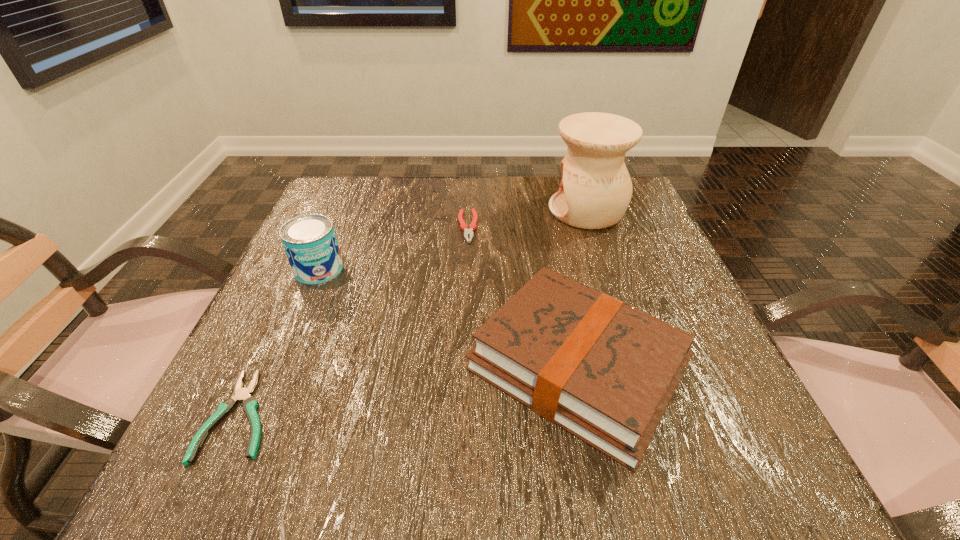
In order to click on free region located 0.120m at the open side of the tallest object in this screenshot , I will do `click(498, 210)`.

You are a GUI agent. You are given a task and a screenshot of the screen. Output one action in this format:
    pyautogui.click(x=<x>, y=<y>)
    Task: Click on the blank space located 0.270m on the front of the fourth shortest object
    The height and width of the screenshot is (540, 960).
    Given the screenshot: What is the action you would take?
    pyautogui.click(x=260, y=407)

The image size is (960, 540). In order to click on vacant region located on the back of the hardback book in this screenshot , I will do `click(548, 222)`.

Where is `vacant space located on the front of the taller pliers`? vacant space located on the front of the taller pliers is located at coordinates (465, 321).

You are a GUI agent. You are given a task and a screenshot of the screen. Output one action in this format:
    pyautogui.click(x=<x>, y=<y>)
    Task: Click on the vacant space positioned on the right of the left pliers
    This screenshot has height=540, width=960.
    Given the screenshot: What is the action you would take?
    pyautogui.click(x=423, y=415)

Find the location of a particular element. This screenshot has width=960, height=540. pottery at the far edge is located at coordinates (595, 190).

At what (x,y) coordinates should I click in order to perform the action: click on pliers situated at the far edge. Please return your answer as a coordinate pair (x, y). Looking at the image, I should click on (467, 232).

This screenshot has width=960, height=540. I want to click on hardback book positioned at the near edge, so click(604, 371).

At what (x,y) coordinates should I click in order to perform the action: click on pliers at the near edge. Please return your answer as a coordinate pair (x, y). The width and height of the screenshot is (960, 540). Looking at the image, I should click on pos(249,403).

Identify the location of can that is at the left edge. This screenshot has height=540, width=960. (310, 243).